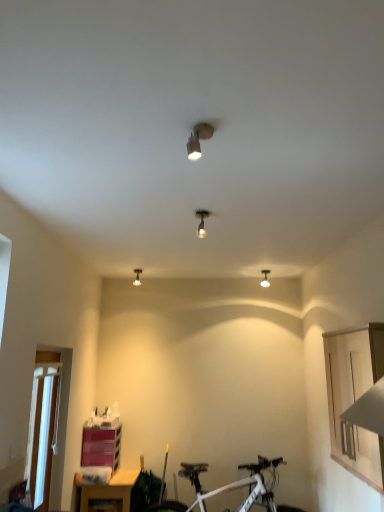
Question: From their relative heights in the image, would you say matte silver spotlight at upper center, the 1th light fixture positioned from the front, is taller or shorter than white plastic window screen at lower left?

Choices:
 (A) tall
 (B) short

Answer: (B)

Question: In terms of size, does matte silver spotlight at upper center, which ranks as the fourth light fixture in back-to-front order, appear bigger or smaller than white plastic window screen at lower left?

Choices:
 (A) small
 (B) big

Answer: (A)

Question: Estimate the real-world distances between objects in this image. Which object is farther from the matte wood table at lower left?

Choices:
 (A) matte silver spotlight at upper center, the 3th light fixture from the right
 (B) matte silver spotlight at center, the third light fixture in the bottom-to-top sequence
 (C) matte silver light fixture at center, which is counted as the 1th light fixture, starting from the back
 (D) matte white light fixture at upper center, arranged as the first light fixture when viewed from the right
 (E) white matte bicycle at lower center

Answer: (A)

Question: Estimate the real-world distances between objects in this image. Which object is closer to the white matte bicycle at lower center?

Choices:
 (A) matte silver spotlight at upper center, the 3th light fixture from the right
 (B) matte silver spotlight at center, the 3th light fixture in the left-to-right sequence
 (C) matte white light fixture at upper center, arranged as the first light fixture when viewed from the right
 (D) pink plastic shelf at lower left
 (E) white plastic window screen at lower left

Answer: (D)